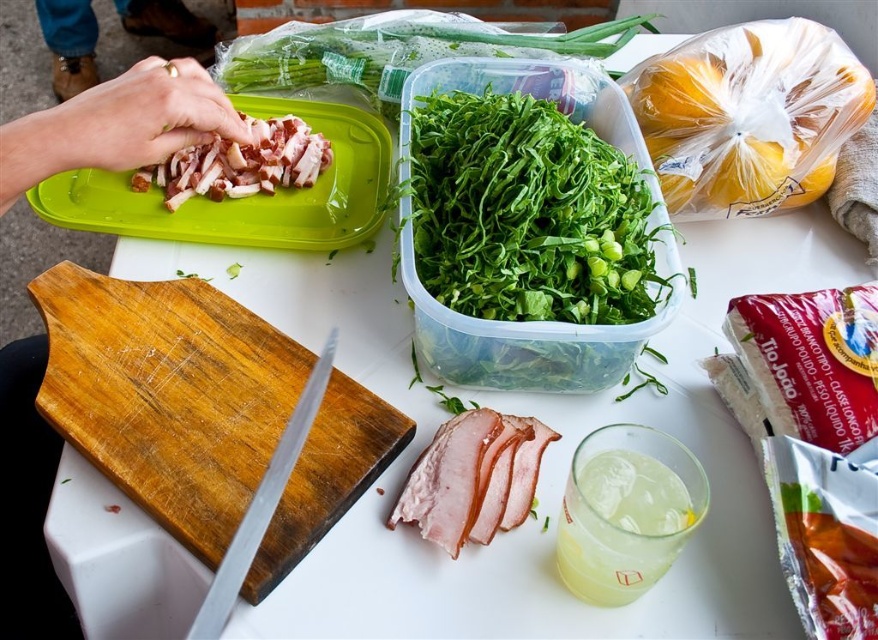
Between smooth pinkish skin at upper left and gold ring at upper left, which one has more height?

Standing taller between the two is gold ring at upper left.

Is point (142, 67) closer to camera compared to point (70, 74)?

Yes, point (142, 67) is closer to viewer.

The width and height of the screenshot is (878, 640). In order to click on smooth pinkish skin at upper left in this screenshot , I will do `click(117, 125)`.

Does sliced pinkish-brown meat at center appear under gold ring at upper left?

Yes.

Which is below, sliced pinkish-brown meat at center or gold ring at upper left?

sliced pinkish-brown meat at center

Find the location of a particular element. sliced pinkish-brown meat at center is located at coordinates pyautogui.click(x=473, y=477).

Does wooden cutting board at lower left have a lesser height compared to sliced pinkish-brown meat at upper left?

In fact, wooden cutting board at lower left may be taller than sliced pinkish-brown meat at upper left.

The height and width of the screenshot is (640, 878). Describe the element at coordinates (167, 394) in the screenshot. I see `wooden cutting board at lower left` at that location.

You are a GUI agent. You are given a task and a screenshot of the screen. Output one action in this format:
    pyautogui.click(x=<x>, y=<y>)
    Task: Click on the wooden cutting board at lower left
    
    Given the screenshot: What is the action you would take?
    pyautogui.click(x=167, y=394)